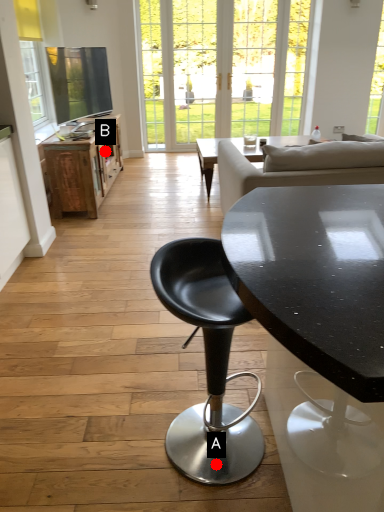
Question: Two points are circled on the image, labeled by A and B beside each circle. Which point is farther to the camera?

Choices:
 (A) A is further
 (B) B is further

Answer: (B)